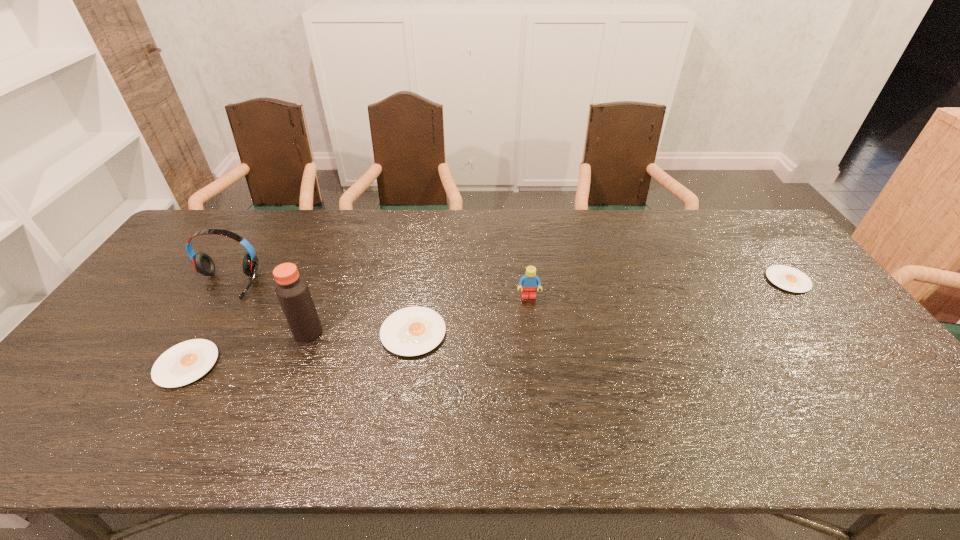
Locate an element on the screen. Image resolution: width=960 pixels, height=540 pixels. vacant space at the near edge of the desktop is located at coordinates (219, 405).

In order to click on vacant space at the left edge in this screenshot , I will do `click(117, 315)`.

You are a GUI agent. You are given a task and a screenshot of the screen. Output one action in this format:
    pyautogui.click(x=<x>, y=<y>)
    Task: Click on the vacant space at the right edge of the desktop
    
    Given the screenshot: What is the action you would take?
    pyautogui.click(x=817, y=354)

Identify the location of vacant region between the third tallest object and the second egg yolk from right to left. Image resolution: width=960 pixels, height=540 pixels. 471,315.

Image resolution: width=960 pixels, height=540 pixels. In order to click on vacant point located between the rightmost object and the second egg yolk from right to left in this screenshot , I will do `click(600, 306)`.

Locate an element on the screen. The height and width of the screenshot is (540, 960). free spot between the fourth shortest object and the third object from right to left is located at coordinates (471, 315).

Find the location of a particular element. free point between the fifth shortest object and the rightmost object is located at coordinates (507, 282).

Find the location of `vacant area between the vinegar and the fifth shortest object`. vacant area between the vinegar and the fifth shortest object is located at coordinates (268, 308).

The width and height of the screenshot is (960, 540). What are the coordinates of `unoccupied position between the rightmost object and the headset` in the screenshot? It's located at click(x=507, y=282).

Where is `free area in between the rightmost object and the tallest object`? The width and height of the screenshot is (960, 540). free area in between the rightmost object and the tallest object is located at coordinates (548, 306).